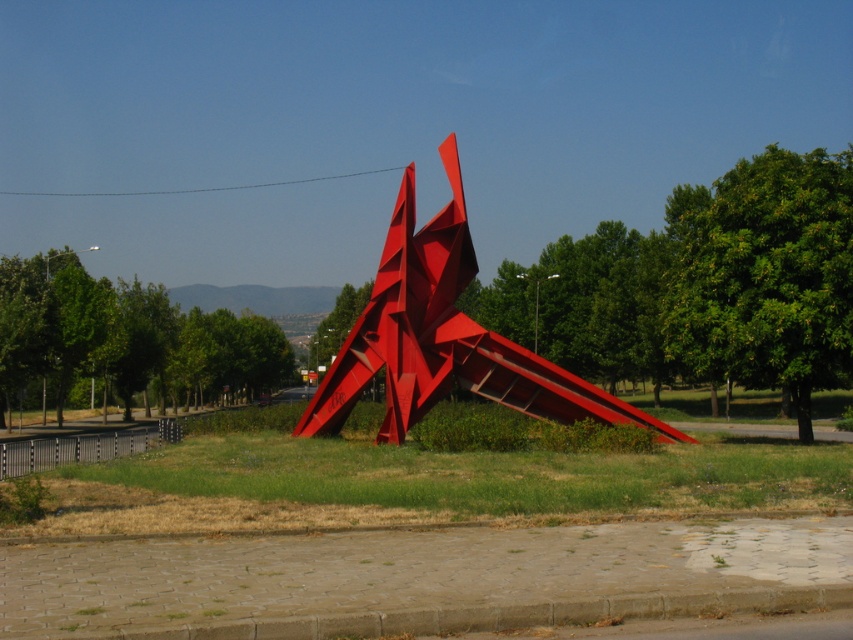
Does green grass at center appear on the right side of glossy metal sculpture at center?

Indeed, green grass at center is positioned on the right side of glossy metal sculpture at center.

Between point (595, 465) and point (436, 225), which one is positioned in front?

Positioned in front is point (595, 465).

This screenshot has height=640, width=853. In order to click on green grass at center in this screenshot , I will do `click(416, 477)`.

Is green leafy tree at center closer to camera compared to glossy metal sculpture at center?

Yes, green leafy tree at center is closer to the viewer.

Which is behind, point (689, 307) or point (462, 237)?

Point (462, 237)

Image resolution: width=853 pixels, height=640 pixels. In order to click on green leafy tree at center in this screenshot , I will do `click(764, 275)`.

Is point (451, 467) closer to viewer compared to point (109, 294)?

Yes, point (451, 467) is closer to viewer.

Is point (786, 477) positioned behind point (163, 387)?

No, it is in front of (163, 387).

Locate an element on the screen. green grass at center is located at coordinates (416, 477).